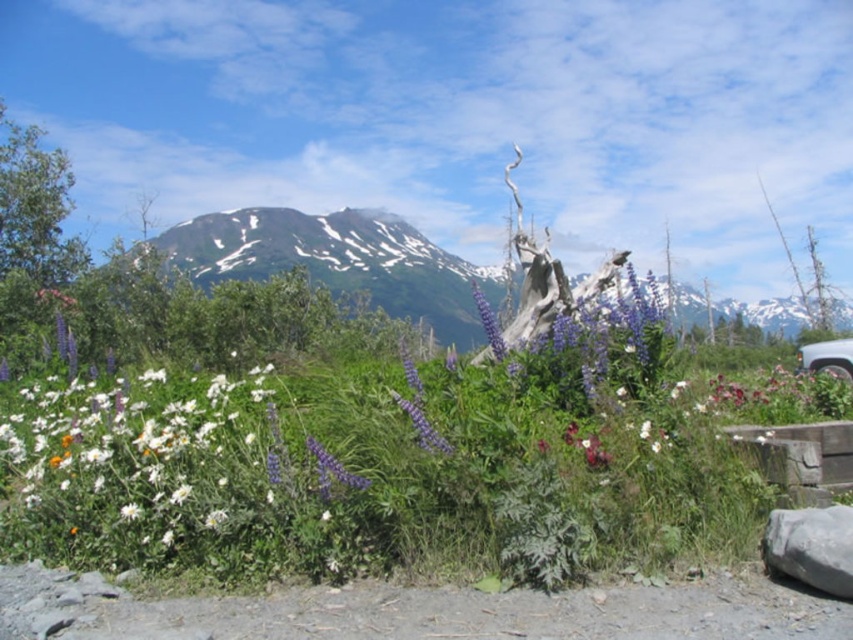
Question: Which point is closer to the camera?

Choices:
 (A) purple matte lupine at center
 (B) green leafy grass at center

Answer: (B)

Question: Observing the image, what is the correct spatial positioning of green leafy grass at center in reference to white glossy car at lower right?

Choices:
 (A) above
 (B) below

Answer: (A)

Question: Can you confirm if green leafy grass at center is smaller than purple matte lupine at center?

Choices:
 (A) yes
 (B) no

Answer: (A)

Question: Among these objects, which one is farthest from the camera?

Choices:
 (A) white matte flower at left
 (B) purple matte flower at center
 (C) purple matte lupine at center
 (D) white glossy car at lower right

Answer: (D)

Question: Which object appears farthest from the camera in this image?

Choices:
 (A) purple matte flower at center
 (B) purple matte lupine at center
 (C) white matte flower at left

Answer: (B)

Question: Does white matte flower at left have a lesser width compared to purple matte lupine at center?

Choices:
 (A) yes
 (B) no

Answer: (B)